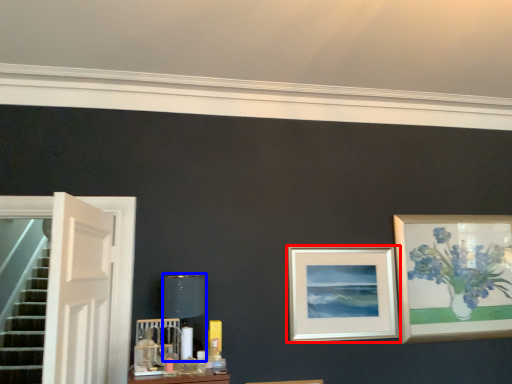
Question: Which point is further to the camera, picture frame (highlighted by a red box) or table lamp (highlighted by a blue box)?

Choices:
 (A) picture frame
 (B) table lamp

Answer: (A)